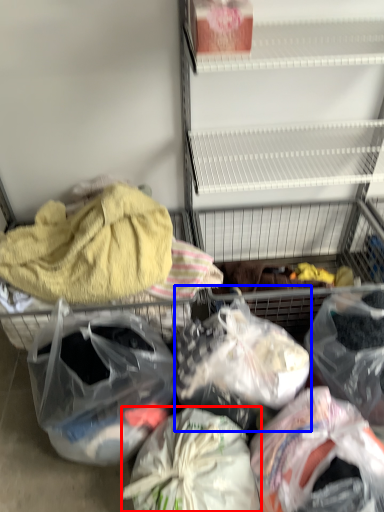
Question: Which point is closer to the camera, plastic bag (highlighted by a red box) or plastic bag (highlighted by a blue box)?

Choices:
 (A) plastic bag
 (B) plastic bag

Answer: (A)